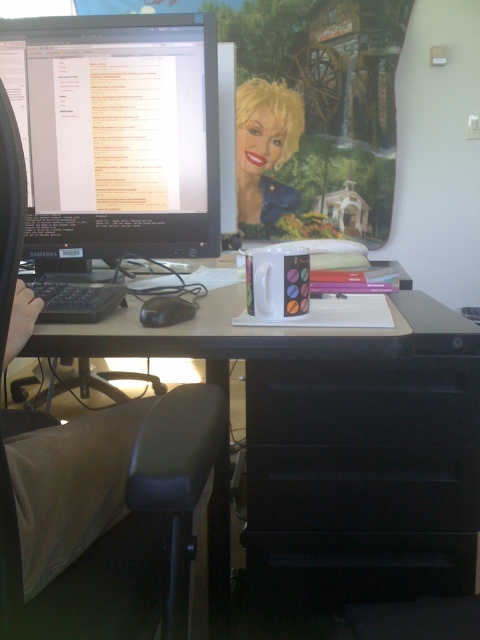
Is black matte file cabinet at lower right further to camera compared to black plastic keyboard at left?

No, black matte file cabinet at lower right is in front of black plastic keyboard at left.

You are a GUI agent. You are given a task and a screenshot of the screen. Output one action in this format:
    pyautogui.click(x=<x>, y=<y>)
    Task: Click on the black matte file cabinet at lower right
    This screenshot has height=640, width=480.
    Given the screenshot: What is the action you would take?
    pyautogui.click(x=367, y=467)

Between black glossy monitor at upper left and matte plastic mug at center, which one has more height?

Standing taller between the two is matte plastic mug at center.

Who is more distant from viewer, [79,253] or [248,108]?

The point [248,108] is behind.

Where is `black glossy monitor at upper left`? Image resolution: width=480 pixels, height=640 pixels. black glossy monitor at upper left is located at coordinates (117, 134).

Does matte plastic mug at center have a larger size compared to black plastic keyboard at left?

Yes.

Is matte plastic mug at center closer to the viewer compared to black plastic keyboard at left?

No.

Describe the element at coordinates (264, 148) in the screenshot. I see `matte plastic mug at center` at that location.

Where is `matte plastic mug at center`? This screenshot has width=480, height=640. matte plastic mug at center is located at coordinates pyautogui.click(x=264, y=148).